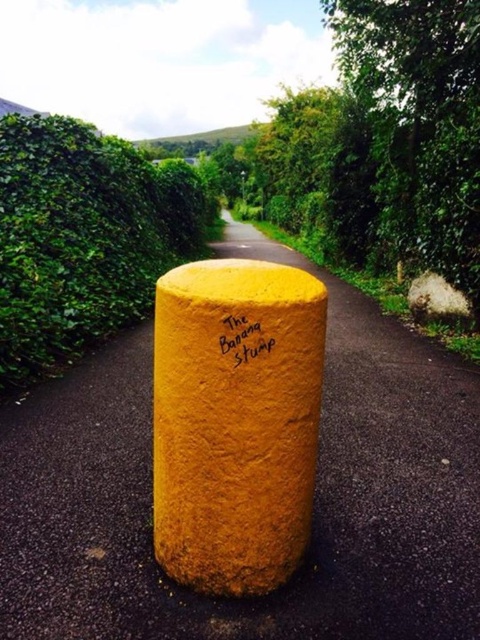
You are a gardener standing on the paved path and want to water the green leafy hedge at left. The yellow textured bollard at center is in your way. Can you move the bollard to the side to access the hedge?

The yellow textured bollard at center is positioned under green leafy hedge at left, so the bollard is located between you and the hedge. Moving the bollard might be necessary to access the hedge for watering.

You are a gardener standing on the path and want to water the green leafy hedge at left and the yellow matte the banana stump at center. Which object is closer to you?

The green leafy hedge at left is positioned over the yellow matte the banana stump at center, so the green leafy hedge at left is closer to you.